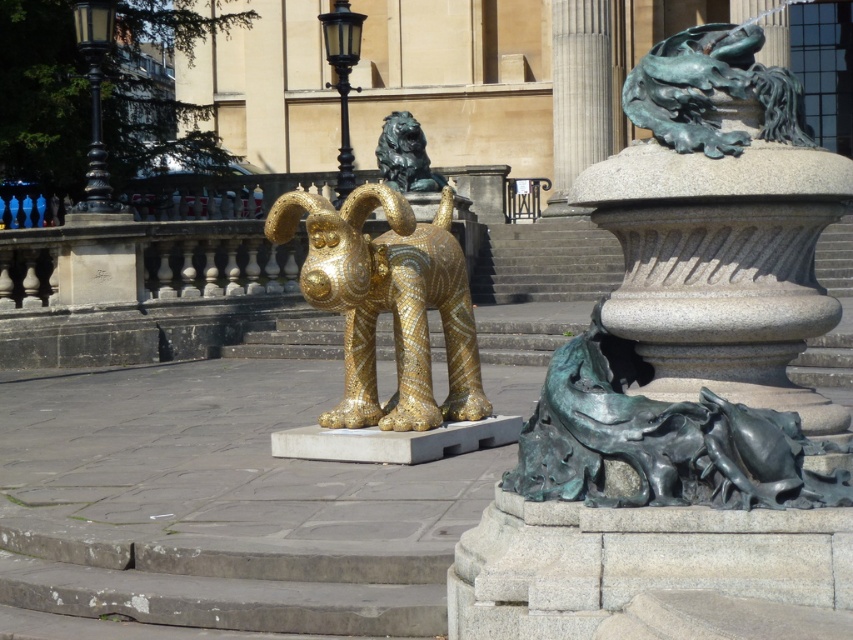
Does green patina bronze horse at lower right come in front of green patina bronze dragon at upper right?

Yes, it is.

What do you see at coordinates (660, 440) in the screenshot? The image size is (853, 640). I see `green patina bronze horse at lower right` at bounding box center [660, 440].

Identify the location of green patina bronze horse at lower right. This screenshot has width=853, height=640. (660, 440).

Between point (344, 305) and point (662, 104), which one is positioned behind?

The point (344, 305) is more distant.

Is gold mosaic ram at center below green patina bronze dragon at upper right?

Yes, gold mosaic ram at center is below green patina bronze dragon at upper right.

Where is `gold mosaic ram at center`? This screenshot has width=853, height=640. gold mosaic ram at center is located at coordinates (387, 304).

At what (x,y) coordinates should I click in order to perform the action: click on gold mosaic ram at center. Please return your answer as a coordinate pair (x, y). The height and width of the screenshot is (640, 853). Looking at the image, I should click on (387, 304).

Measure the distance between point [656,404] and camera.

Point [656,404] is 20.82 feet away from camera.

Which is behind, point (564, 378) or point (415, 410)?

The point (415, 410) is more distant.

Image resolution: width=853 pixels, height=640 pixels. What do you see at coordinates (660, 440) in the screenshot? I see `green patina bronze horse at lower right` at bounding box center [660, 440].

Where is `green patina bronze horse at lower right`? This screenshot has height=640, width=853. green patina bronze horse at lower right is located at coordinates (660, 440).